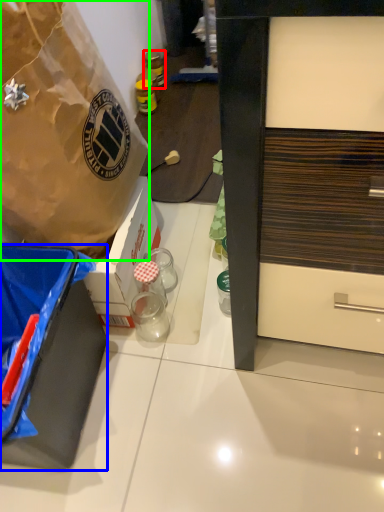
Question: Considering the real-world distances, which object is farthest from bottle (highlighted by a red box)? box (highlighted by a blue box) or box (highlighted by a green box)?

Choices:
 (A) box
 (B) box

Answer: (A)